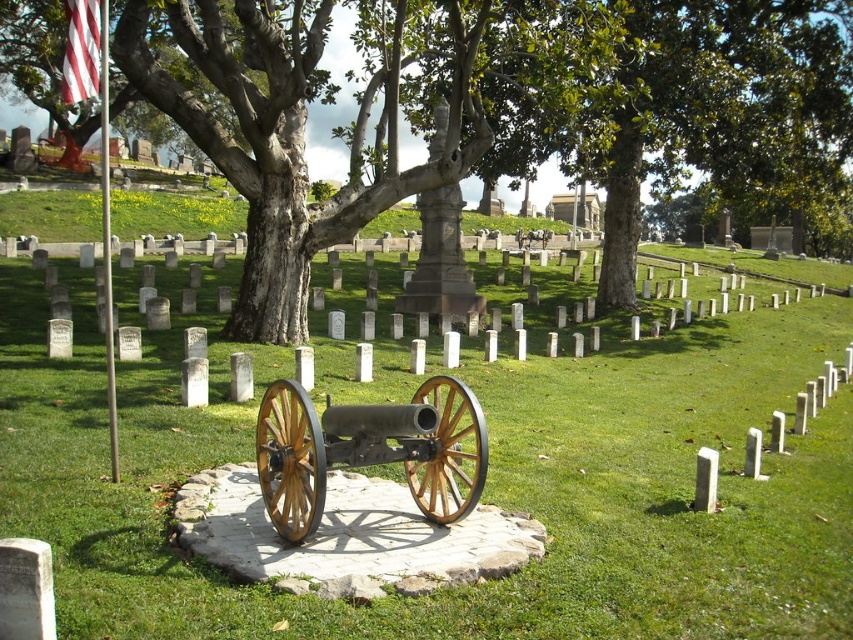
Question: Observing the image, what is the correct spatial positioning of green rough bark tree at center in reference to wooden cannon at center?

Choices:
 (A) above
 (B) below

Answer: (A)

Question: Which object appears farthest from the camera in this image?

Choices:
 (A) green grassy at center
 (B) green rough bark tree at center

Answer: (B)

Question: Is green grassy at center to the right of striped fabric flag at upper left from the viewer's perspective?

Choices:
 (A) yes
 (B) no

Answer: (A)

Question: Does green grassy at center have a smaller size compared to green rough bark tree at center?

Choices:
 (A) yes
 (B) no

Answer: (A)

Question: Which of the following is the closest to the observer?

Choices:
 (A) green rough bark tree at center
 (B) wooden cannon at center
 (C) green grassy at center
 (D) striped fabric flag at upper left

Answer: (C)

Question: Which object appears closest to the camera in this image?

Choices:
 (A) green grassy at center
 (B) striped fabric flag at upper left
 (C) green rough bark tree at center

Answer: (A)